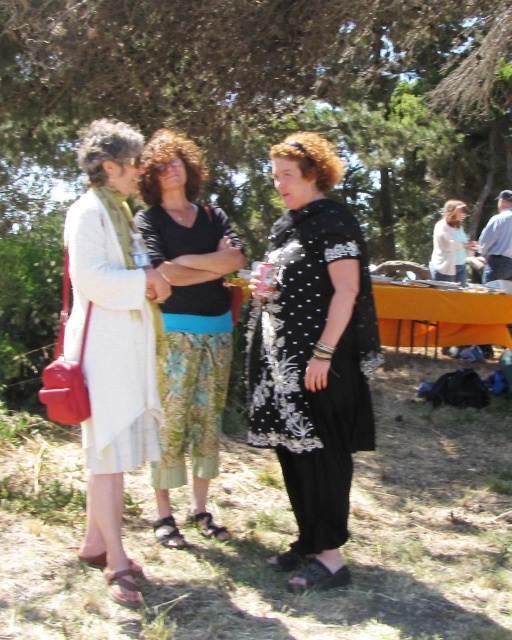
Question: Can you confirm if black embroidered dress at center is smaller than matte white dress at left?

Choices:
 (A) yes
 (B) no

Answer: (A)

Question: Is black embroidered dress at center positioned before white lace dress at center?

Choices:
 (A) yes
 (B) no

Answer: (A)

Question: Is green floral pants at center below white lace dress at center?

Choices:
 (A) no
 (B) yes

Answer: (B)

Question: Which object is closer to the camera taking this photo?

Choices:
 (A) matte white dress at left
 (B) black embroidered dress at center
 (C) green floral pants at center

Answer: (A)

Question: Considering the real-world distances, which object is farthest from the green floral pants at center?

Choices:
 (A) green leafy tree at upper center
 (B) matte white dress at left

Answer: (A)

Question: Which object is the closest to the green leafy tree at upper center?

Choices:
 (A) matte white dress at left
 (B) black embroidered dress at center
 (C) white lace dress at center

Answer: (C)